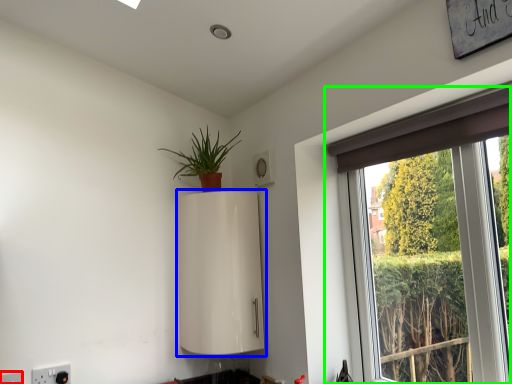
Question: Which object is positioned closest to electric outlet (highlighted by a red box)? Select from appliance (highlighted by a blue box) and window (highlighted by a green box).

Choices:
 (A) appliance
 (B) window

Answer: (A)